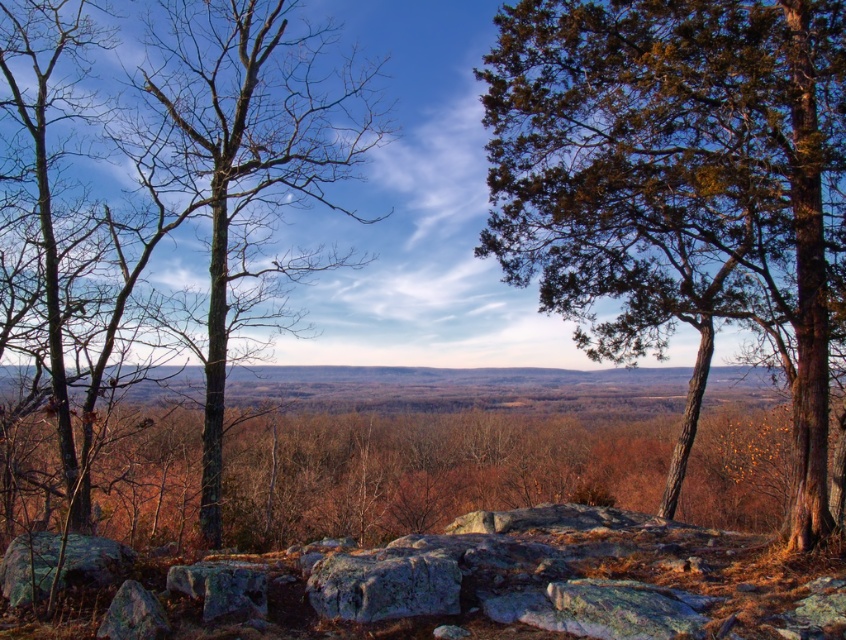
Question: Is green bark tree at left in front of gray rough boulder at center?

Choices:
 (A) no
 (B) yes

Answer: (A)

Question: Which point appears closest to the camera in this image?

Choices:
 (A) (630, 193)
 (B) (363, 612)
 (C) (31, 541)

Answer: (B)

Question: Is green textured tree at upper right to the right of gray rough boulder at center from the viewer's perspective?

Choices:
 (A) yes
 (B) no

Answer: (A)

Question: Which of the following is the closest to the observer?

Choices:
 (A) (272, 60)
 (B) (338, 579)
 (C) (838, 52)

Answer: (B)

Question: Is gray rough boulder at center bigger than green mossy rock at lower left?

Choices:
 (A) yes
 (B) no

Answer: (B)

Question: Based on their relative distances, which object is farther from the green mossy rock at lower left?

Choices:
 (A) green bark tree at left
 (B) gray rough boulder at center

Answer: (A)